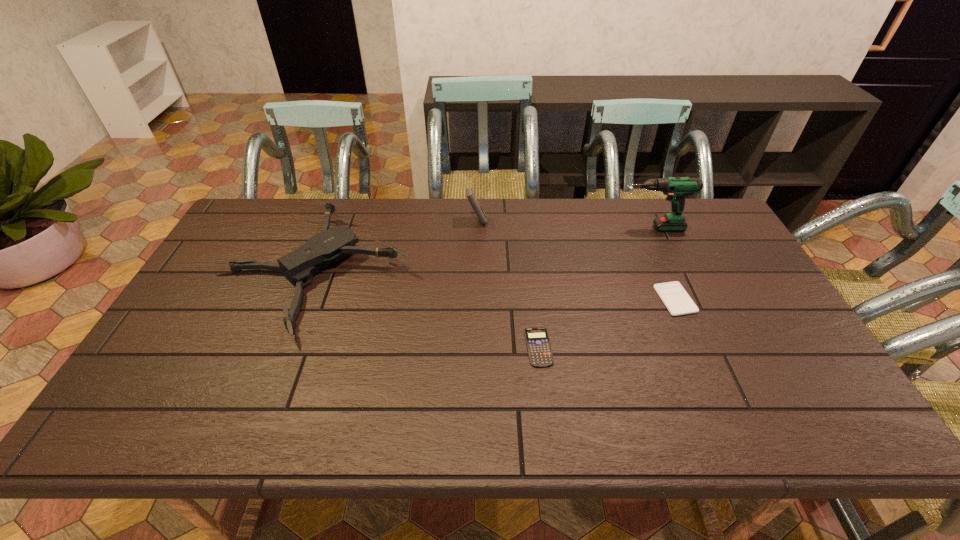
This screenshot has height=540, width=960. What are the coordinates of `vacant region between the shortest calculator and the drone` in the screenshot? It's located at (426, 309).

Where is `free space that is in between the leftmost object and the second farthest calculator`? The height and width of the screenshot is (540, 960). free space that is in between the leftmost object and the second farthest calculator is located at coordinates (494, 286).

The image size is (960, 540). In order to click on unoccupied area between the third shortest object and the rightmost calculator in this screenshot , I will do tap(494, 286).

I want to click on free spot between the third object from right to left and the drone, so click(426, 309).

Image resolution: width=960 pixels, height=540 pixels. In order to click on free space that is in between the second object from left to right and the tallest object in this screenshot , I will do `click(564, 225)`.

Locate an element on the screen. empty space that is in between the third tallest object and the fourth shortest object is located at coordinates (395, 246).

Locate an element on the screen. The image size is (960, 540). vacant area between the drone and the tallest calculator is located at coordinates (395, 246).

The image size is (960, 540). I want to click on free space between the drill and the leftmost object, so click(x=482, y=250).

I want to click on object that ranks as the second closest to the fourth object from right to left, so click(x=676, y=188).

Image resolution: width=960 pixels, height=540 pixels. What are the coordinates of `object that stands as the closest to the second farthest calculator` in the screenshot? It's located at pos(676,188).